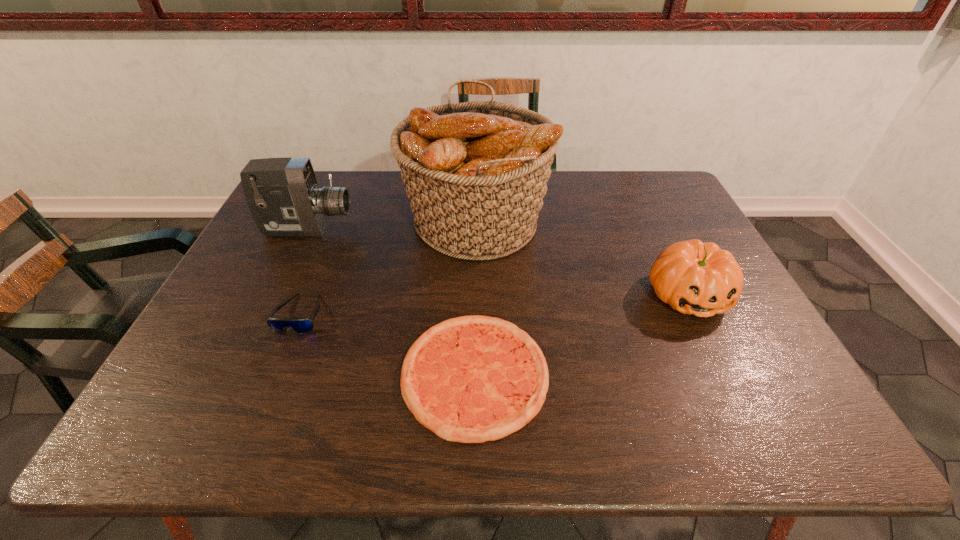
In order to click on basket in this screenshot , I will do `click(476, 173)`.

Find the location of `the fourth shortest object`. the fourth shortest object is located at coordinates (283, 196).

I want to click on the third tallest object, so click(x=693, y=277).

I want to click on the rightmost object, so click(x=693, y=277).

Identify the location of sunglasses. The width and height of the screenshot is (960, 540). (301, 325).

This screenshot has height=540, width=960. I want to click on the shortest object, so click(x=470, y=379).

Image resolution: width=960 pixels, height=540 pixels. What are the coordinates of `vacant area located on the back of the tallest object` in the screenshot? It's located at (476, 171).

You are a GUI agent. You are given a task and a screenshot of the screen. Output one action in this format:
    pyautogui.click(x=<x>, y=<y>)
    Task: Click on the free space located at the front of the second tallest object, highlighting the lens
    The height and width of the screenshot is (540, 960).
    Given the screenshot: What is the action you would take?
    pyautogui.click(x=423, y=229)

The height and width of the screenshot is (540, 960). I want to click on free space located 0.230m on the carved face of the third shortest object, so click(745, 412).

Identify the location of vacant space located on the front-facing side of the sunglasses. This screenshot has height=540, width=960. (269, 392).